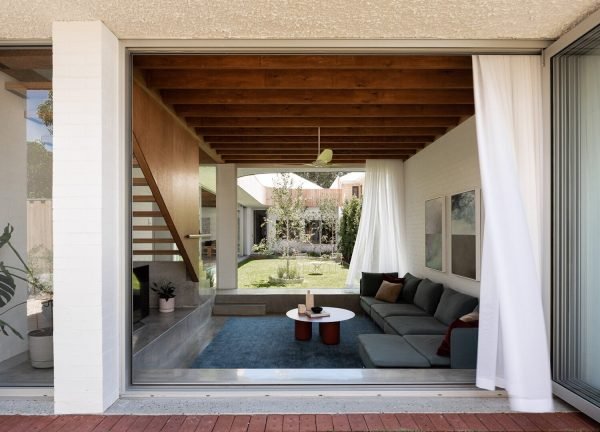
Image resolution: width=600 pixels, height=432 pixels. I want to click on white curtain, so click(x=519, y=257), click(x=378, y=210).